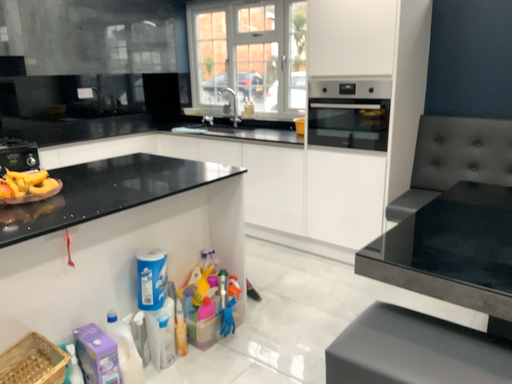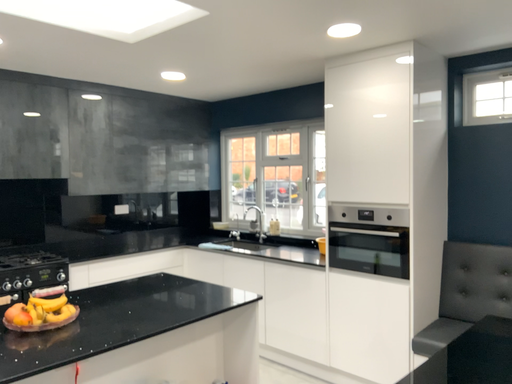
Question: Which way did the camera rotate in the video?

Choices:
 (A) rotated upward
 (B) rotated downward

Answer: (A)